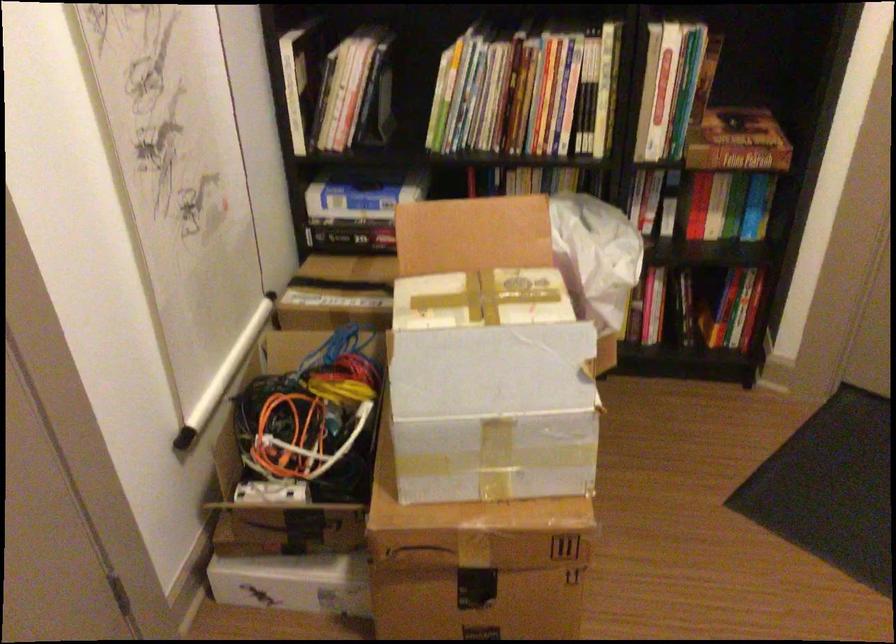
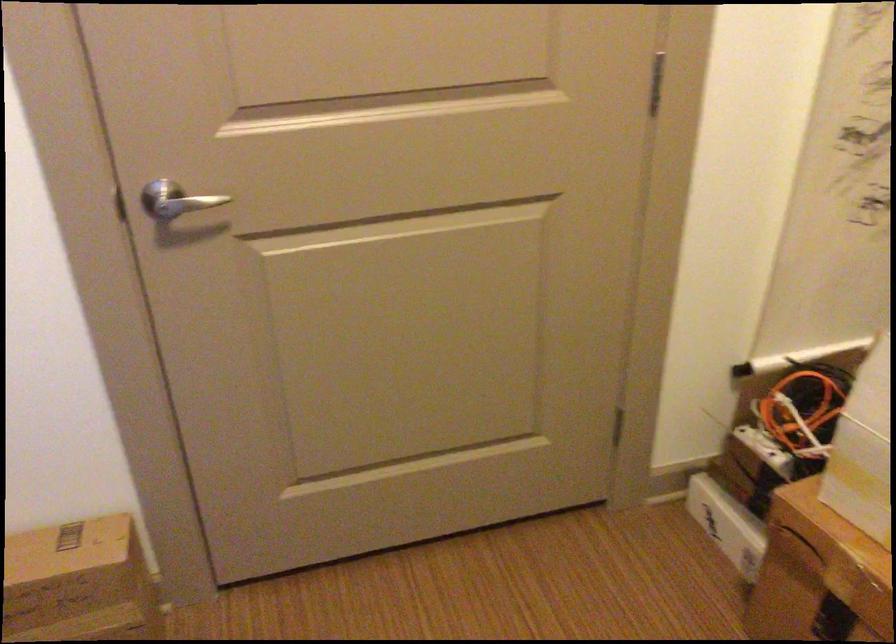
Find the pixel in the second image that matches pixel 271 500 in the first image.

(764, 450)